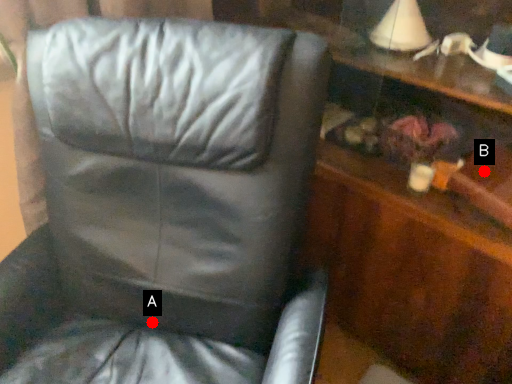
Question: Two points are circled on the image, labeled by A and B beside each circle. Which point is farther to the camera?

Choices:
 (A) A is further
 (B) B is further

Answer: (A)